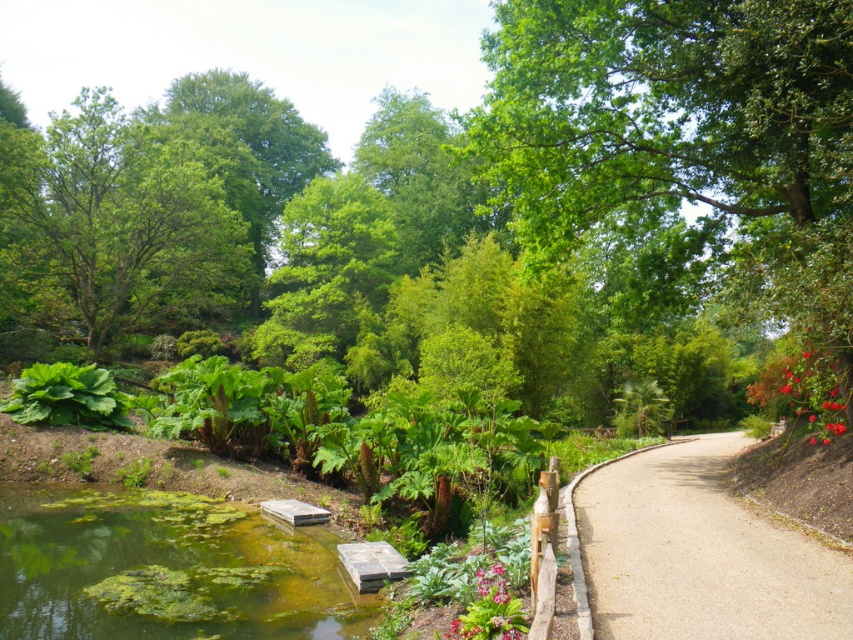
Measure the distance between green leafy tree at upper center and smooth gravel path at center.

green leafy tree at upper center is 4.96 meters from smooth gravel path at center.

Does green leafy tree at upper center lie in front of smooth gravel path at center?

No.

At what (x,y) coordinates should I click in order to perform the action: click on green leafy tree at upper center. Please return your answer as a coordinate pair (x, y). Looking at the image, I should click on (691, 147).

Find the location of `green leafy tree at upper center`. green leafy tree at upper center is located at coordinates (691, 147).

Which of these two, green leafy plant at lower center or pink glossy flower at lower center, stands taller?

Standing taller between the two is green leafy plant at lower center.

Does green leafy plant at lower center come in front of pink glossy flower at lower center?

Yes, green leafy plant at lower center is closer to the viewer.

Describe the element at coordinates (490, 609) in the screenshot. I see `green leafy plant at lower center` at that location.

At what (x,y) coordinates should I click in order to perform the action: click on green leafy plant at lower center. Please return your answer as a coordinate pair (x, y). This screenshot has width=853, height=640. Looking at the image, I should click on (490, 609).

Is point (556, 202) positioned before point (183, 508)?

No, (556, 202) is behind (183, 508).

Can you confirm if green leafy tree at upper center is positioned above green algae-covered water at lower left?

Correct, green leafy tree at upper center is located above green algae-covered water at lower left.

Between point (844, 352) and point (9, 531), which one is positioned behind?

The point (844, 352) is behind.

This screenshot has width=853, height=640. In order to click on green leafy tree at upper center in this screenshot , I will do `click(691, 147)`.